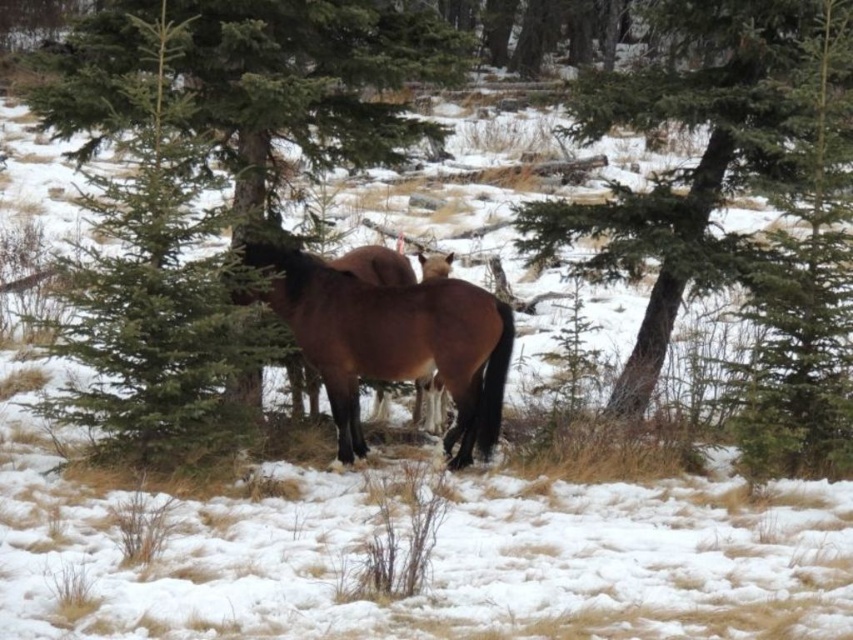
Question: Which point is closer to the camera?

Choices:
 (A) brown glossy horse at center
 (B) green textured pine tree at center
 (C) green textured tree at center

Answer: (C)

Question: Can you confirm if green textured pine tree at center is wider than brown glossy horse at center?

Choices:
 (A) no
 (B) yes

Answer: (A)

Question: Can you confirm if green textured pine tree at center is positioned below brown glossy horse at center?

Choices:
 (A) yes
 (B) no

Answer: (B)

Question: Does green textured tree at center have a lesser width compared to brown glossy horse at center?

Choices:
 (A) yes
 (B) no

Answer: (B)

Question: Estimate the real-world distances between objects in this image. Which object is farther from the brown glossy horse at center?

Choices:
 (A) green textured tree at center
 (B) green textured pine tree at center

Answer: (A)

Question: Estimate the real-world distances between objects in this image. Which object is closer to the brown glossy horse at center?

Choices:
 (A) green textured tree at center
 (B) green textured pine tree at center

Answer: (B)